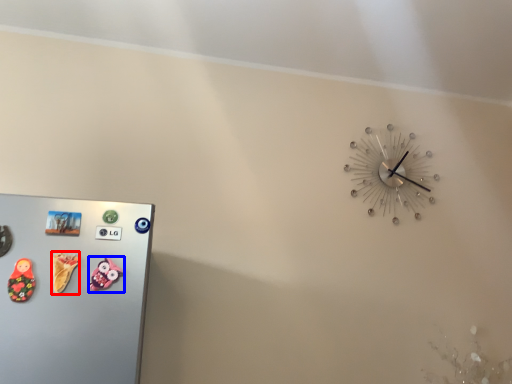
Question: Which object is further to the camera taking this photo, toy (highlighted by a red box) or toy (highlighted by a blue box)?

Choices:
 (A) toy
 (B) toy

Answer: (B)